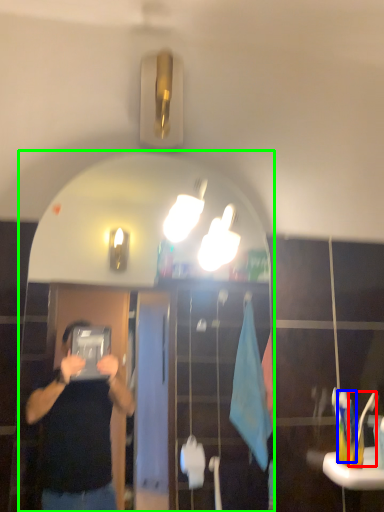
Question: Based on their relative distances, which object is farther from toothbrush (highlighted by a red box)? Choose from toothbrush (highlighted by a blue box) and mirror (highlighted by a green box).

Choices:
 (A) toothbrush
 (B) mirror

Answer: (B)